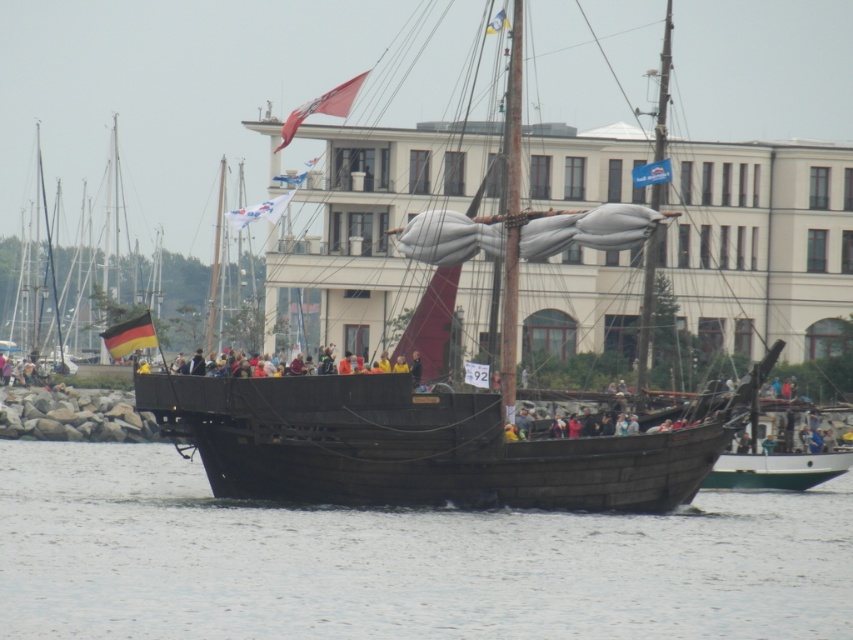
Is yellow-red-yellow flag at center above yellow fabric flag at upper center?

Incorrect, yellow-red-yellow flag at center is not positioned above yellow fabric flag at upper center.

Does yellow-red-yellow flag at center have a greater height compared to yellow fabric flag at upper center?

In fact, yellow-red-yellow flag at center may be shorter than yellow fabric flag at upper center.

Is point (146, 314) positioned after point (498, 19)?

No, (146, 314) is in front of (498, 19).

Where is `yellow-red-yellow flag at center`? Image resolution: width=853 pixels, height=640 pixels. yellow-red-yellow flag at center is located at coordinates (131, 336).

Does smooth water at center appear on the right side of yellow fabric flag at upper center?

Incorrect, smooth water at center is not on the right side of yellow fabric flag at upper center.

Does point (688, 529) come behind point (500, 13)?

No, it is not.

The image size is (853, 640). I want to click on smooth water at center, so click(x=398, y=561).

Is wooden pirate ship at center shorter than red fabric flag at upper center?

In fact, wooden pirate ship at center may be taller than red fabric flag at upper center.

This screenshot has height=640, width=853. Find the location of `wooden pirate ship at center`. wooden pirate ship at center is located at coordinates (436, 428).

Is point (529, 484) positioned behind point (352, 80)?

That is False.

I want to click on wooden pirate ship at center, so click(x=436, y=428).